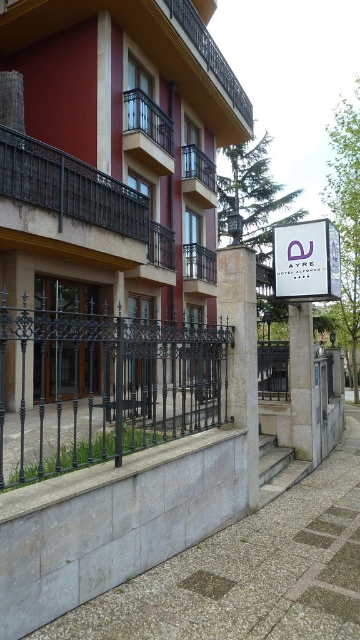
Between white stone pillar at center and white concrete pillar at center, which one appears on the left side from the viewer's perspective?

Positioned to the left is white stone pillar at center.

Is white stone pillar at center above white concrete pillar at center?

Yes, white stone pillar at center is above white concrete pillar at center.

Locate an element on the screen. Image resolution: width=360 pixels, height=640 pixels. white stone pillar at center is located at coordinates (241, 349).

Is black wrought iron fence at center bigger than purple glossy sign at center?

Yes, black wrought iron fence at center is bigger than purple glossy sign at center.

Does black wrought iron fence at center have a smaller size compared to purple glossy sign at center?

Incorrect, black wrought iron fence at center is not smaller in size than purple glossy sign at center.

Identify the location of black wrought iron fence at center. (101, 387).

Can you confirm if matte brown building at center is positioned above black wrought iron fence at center?

Indeed, matte brown building at center is positioned over black wrought iron fence at center.

Can you confirm if matte brown building at center is positioned to the right of black wrought iron fence at center?

Correct, you'll find matte brown building at center to the right of black wrought iron fence at center.

What do you see at coordinates (115, 150) in the screenshot?
I see `matte brown building at center` at bounding box center [115, 150].

What are the coordinates of `matte brown building at center` in the screenshot? It's located at [x=115, y=150].